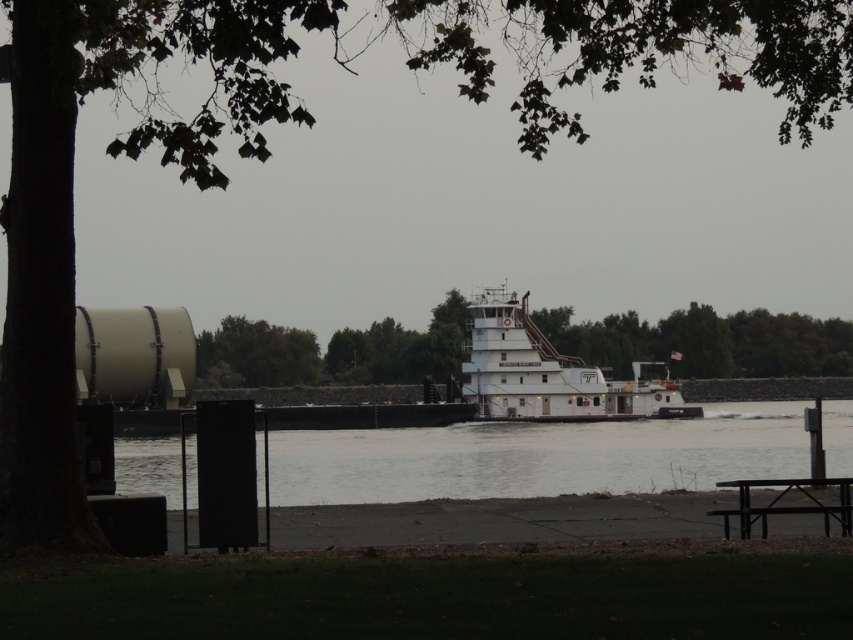
Between point (554, 481) and point (805, 506), which one is positioned behind?

The point (554, 481) is behind.

Who is lower down, clear water at center or black metal picnic table at lower right?

clear water at center is below.

Which is in front, point (753, 444) or point (776, 513)?

Point (776, 513) is more forward.

Locate an element on the screen. clear water at center is located at coordinates (537, 456).

Which is more to the right, white matte tugboat at center or black metal picnic table at lower right?

white matte tugboat at center

Can you confirm if white matte tugboat at center is taller than black metal picnic table at lower right?

Indeed, white matte tugboat at center has a greater height compared to black metal picnic table at lower right.

Image resolution: width=853 pixels, height=640 pixels. Find the location of `white matte tugboat at center`. white matte tugboat at center is located at coordinates (549, 372).

Measure the distance between clear water at center and white matte tugboat at center.

clear water at center is 13.53 meters away from white matte tugboat at center.

This screenshot has width=853, height=640. I want to click on clear water at center, so click(x=537, y=456).

Locate an element on the screen. clear water at center is located at coordinates (537, 456).